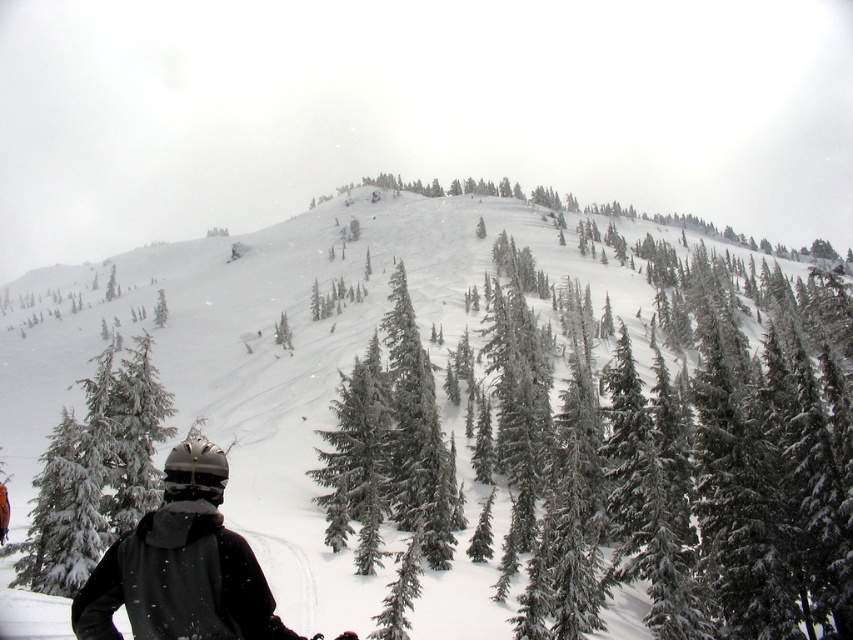
Question: Among these points, which one is farthest from the camera?

Choices:
 (A) (47, 573)
 (B) (688, 314)

Answer: (B)

Question: Among these points, which one is nearest to the camera?

Choices:
 (A) (705, 333)
 (B) (112, 406)

Answer: (B)

Question: Does white fluffy snow at center appear on the right side of snow-covered evergreen tree at lower left?

Choices:
 (A) yes
 (B) no

Answer: (A)

Question: Is white fluffy snow at center further to the viewer compared to snow-covered evergreen tree at lower left?

Choices:
 (A) yes
 (B) no

Answer: (B)

Question: Can you confirm if white fluffy snow at center is positioned to the left of snow-covered evergreen tree at lower left?

Choices:
 (A) yes
 (B) no

Answer: (B)